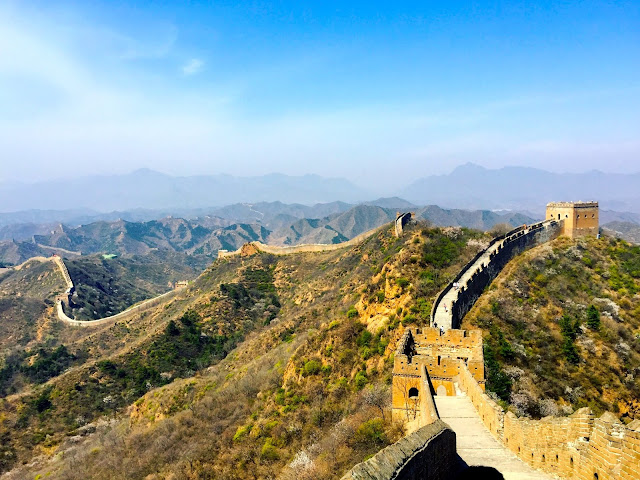
At what (x,y) coordinates should I click in order to perform the action: click on holes in wall. Please return your answer as a coordinate pair (x, y). Looking at the image, I should click on (570, 457), (554, 456), (540, 458), (532, 454).